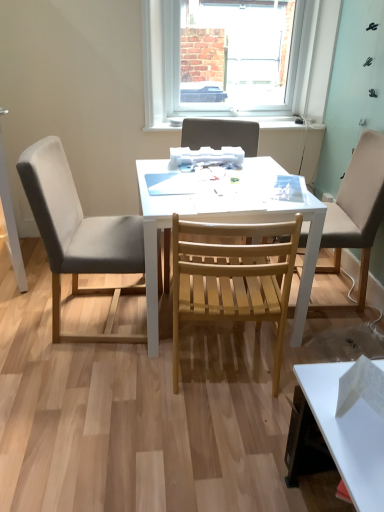
Where is `natural wood chair at center, which is the 3th chair from left to right`? Image resolution: width=384 pixels, height=512 pixels. natural wood chair at center, which is the 3th chair from left to right is located at coordinates (233, 277).

Considering the relative sizes of natural wood chair at center, which is the 3th chair from left to right, and white plastic window at upper center in the image provided, is natural wood chair at center, which is the 3th chair from left to right, bigger than white plastic window at upper center?

Yes.

Consider the image. From a real-world perspective, relative to white plastic window at upper center, is natural wood chair at center, which is counted as the 2th chair, starting from the right, vertically above or below?

Clearly, from a real-world perspective, natural wood chair at center, which is counted as the 2th chair, starting from the right, is below white plastic window at upper center.

Can you confirm if natural wood chair at center, which is counted as the 2th chair, starting from the right, is shorter than white plastic window at upper center?

No.

From the image's perspective, is natural wood chair at center, which is counted as the 2th chair, starting from the right, below white plastic window at upper center?

Yes, from the image's perspective, natural wood chair at center, which is counted as the 2th chair, starting from the right, is beneath white plastic window at upper center.

Does gray fabric chair at left, acting as the 4th chair starting from the right, have a smaller size compared to white plastic window at upper center?

Actually, gray fabric chair at left, acting as the 4th chair starting from the right, might be larger than white plastic window at upper center.

Is white plastic window at upper center at the back of gray fabric chair at left, acting as the 4th chair starting from the right?

gray fabric chair at left, acting as the 4th chair starting from the right, does not have its back to white plastic window at upper center.

Considering the positions of point (63, 177) and point (176, 41), is point (63, 177) closer or farther from the camera than point (176, 41)?

Point (63, 177).

The height and width of the screenshot is (512, 384). Find the location of `window on the right of gray fabric chair at left, placed as the 1th chair when sorted from left to right`. window on the right of gray fabric chair at left, placed as the 1th chair when sorted from left to right is located at coordinates (164, 65).

From a real-world perspective, is gray fabric chair at left, placed as the 1th chair when sorted from left to right, located beneath white matte desk at center?

Actually, gray fabric chair at left, placed as the 1th chair when sorted from left to right, is physically above white matte desk at center in the real world.

Looking at this image, based on their sizes in the image, would you say gray fabric chair at left, placed as the 1th chair when sorted from left to right, is bigger or smaller than white matte desk at center?

Considering their sizes, gray fabric chair at left, placed as the 1th chair when sorted from left to right, takes up less space than white matte desk at center.

From the picture: Is gray fabric chair at left, placed as the 1th chair when sorted from left to right, taller or shorter than white matte desk at center?

In the image, gray fabric chair at left, placed as the 1th chair when sorted from left to right, appears to be taller than white matte desk at center.

Is gray fabric chair at left, acting as the 4th chair starting from the right, oriented away from white matte desk at center?

gray fabric chair at left, acting as the 4th chair starting from the right, does not have its back to white matte desk at center.

The height and width of the screenshot is (512, 384). In order to click on the 2nd chair positioned above the white matte desk at center (from a real-world perspective) in this screenshot , I will do `click(356, 213)`.

Is white matte desk at center aimed at wooden slatted chair at center, the first chair when ordered from right to left?

No, white matte desk at center is not oriented towards wooden slatted chair at center, the first chair when ordered from right to left.

Considering the sizes of white matte desk at center and wooden slatted chair at center, the first chair when ordered from right to left, in the image, is white matte desk at center bigger or smaller than wooden slatted chair at center, the first chair when ordered from right to left,?

Clearly, white matte desk at center is larger in size than wooden slatted chair at center, the first chair when ordered from right to left.

From the picture: Is white matte desk at center positioned in front of wooden slatted chair at center, marked as the 4th chair in a left-to-right arrangement?

Yes, it is.

Is white matte desk at center directly adjacent to natural wood chair at center, which is the 3th chair from left to right?

white matte desk at center is not next to natural wood chair at center, which is the 3th chair from left to right, and they're not touching.

Is white matte desk at center at the right side of natural wood chair at center, which is counted as the 2th chair, starting from the right?

No, white matte desk at center is not to the right of natural wood chair at center, which is counted as the 2th chair, starting from the right.

Does white matte desk at center have a smaller size compared to natural wood chair at center, which is counted as the 2th chair, starting from the right?

Actually, white matte desk at center might be larger than natural wood chair at center, which is counted as the 2th chair, starting from the right.

Does point (337, 264) come in front of point (158, 205)?

That is False.

From a real-world perspective, between wooden slatted chair at center, the first chair when ordered from right to left, and white matte desk at center, who is vertically lower?

From a 3D spatial view, white matte desk at center is below.

Is wooden slatted chair at center, marked as the 4th chair in a left-to-right arrangement, far away from white matte desk at center?

They are positioned close to each other.

From the image's perspective, is wooden slatted chair at center, marked as the 4th chair in a left-to-right arrangement, positioned above or below white matte desk at center?

From the image's perspective, wooden slatted chair at center, marked as the 4th chair in a left-to-right arrangement, appears above white matte desk at center.

In the image, is natural wood chair at center, which is counted as the 2th chair, starting from the right, positioned in front of or behind wooden slatted chair at center, the first chair when ordered from right to left?

Clearly, natural wood chair at center, which is counted as the 2th chair, starting from the right, is in front of wooden slatted chair at center, the first chair when ordered from right to left.

Does point (275, 348) come farther from viewer compared to point (359, 169)?

No, it is in front of (359, 169).

Is natural wood chair at center, which is counted as the 2th chair, starting from the right, thinner than wooden slatted chair at center, the first chair when ordered from right to left?

Correct, the width of natural wood chair at center, which is counted as the 2th chair, starting from the right, is less than that of wooden slatted chair at center, the first chair when ordered from right to left.

Is natural wood chair at center, which is the 3th chair from left to right, facing away from wooden slatted chair at center, marked as the 4th chair in a left-to-right arrangement?

No.

Which chair is the 1st one when counting from the left side of the white plastic window at upper center? Please provide its 2D coordinates.

[(233, 277)]

The image size is (384, 512). I want to click on window that is above the gray fabric chair at left, placed as the 1th chair when sorted from left to right (from a real-world perspective), so click(164, 65).

When comparing their distances from white matte desk at center, does wooden slatted chair at center, which is the third chair from right to left, or wooden slatted chair at center, the first chair when ordered from right to left, seem closer?

wooden slatted chair at center, the first chair when ordered from right to left.

When comparing their distances from white matte desk at center, does white plastic window at upper center or wooden slatted chair at center, the first chair when ordered from right to left, seem further?

white plastic window at upper center lies further to white matte desk at center than the other object.

From the image, which object appears to be farther from white plastic window at upper center, wooden slatted chair at center, the first chair when ordered from right to left, or white matte desk at center?

wooden slatted chair at center, the first chair when ordered from right to left, is positioned further to the anchor white plastic window at upper center.

Estimate the real-world distances between objects in this image. Which object is closer to wooden slatted chair at center, the first chair when ordered from right to left, white matte desk at center or wooden slatted chair at center, which is the third chair from right to left?

The object closer to wooden slatted chair at center, the first chair when ordered from right to left, is white matte desk at center.

Which object lies nearer to the anchor point natural wood chair at center, which is the 3th chair from left to right, wooden slatted chair at center, the first chair when ordered from right to left, or gray fabric chair at left, placed as the 1th chair when sorted from left to right?

gray fabric chair at left, placed as the 1th chair when sorted from left to right, lies closer to natural wood chair at center, which is the 3th chair from left to right, than the other object.

In the scene shown: Which object lies further to the anchor point wooden slatted chair at center, positioned as the second chair in left-to-right order, gray fabric chair at left, placed as the 1th chair when sorted from left to right, or natural wood chair at center, which is the 3th chair from left to right?

Among the two, natural wood chair at center, which is the 3th chair from left to right, is located further to wooden slatted chair at center, positioned as the second chair in left-to-right order.

Estimate the real-world distances between objects in this image. Which object is closer to wooden slatted chair at center, which is the third chair from right to left, natural wood chair at center, which is counted as the 2th chair, starting from the right, or white plastic window at upper center?

white plastic window at upper center lies closer to wooden slatted chair at center, which is the third chair from right to left, than the other object.

Looking at the image, which one is located further to wooden slatted chair at center, which is the third chair from right to left, white matte desk at center or natural wood chair at center, which is the 3th chair from left to right?

natural wood chair at center, which is the 3th chair from left to right, is further to wooden slatted chair at center, which is the third chair from right to left.

In order to click on chair between white plastic window at upper center and wooden slatted chair at center, the first chair when ordered from right to left, from top to bottom in this screenshot , I will do `click(221, 134)`.

I want to click on desk between gray fabric chair at left, placed as the 1th chair when sorted from left to right, and wooden slatted chair at center, marked as the 4th chair in a left-to-right arrangement, in the horizontal direction, so click(x=226, y=222).

Locate an element on the screen. The height and width of the screenshot is (512, 384). desk between white plastic window at upper center and natural wood chair at center, which is the 3th chair from left to right, in the vertical direction is located at coordinates (226, 222).

Identify the location of chair between gray fabric chair at left, acting as the 4th chair starting from the right, and natural wood chair at center, which is the 3th chair from left to right, in the horizontal direction. This screenshot has width=384, height=512. (221, 134).